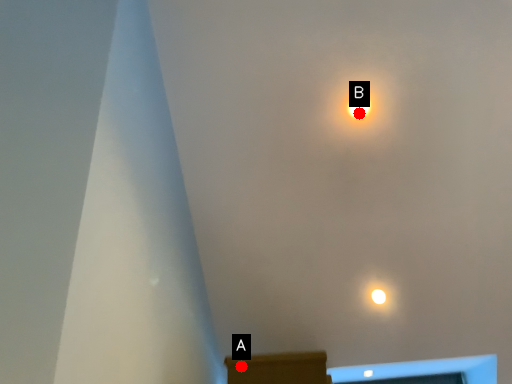
Question: Two points are circled on the image, labeled by A and B beside each circle. Which point is closer to the camera?

Choices:
 (A) A is closer
 (B) B is closer

Answer: (A)